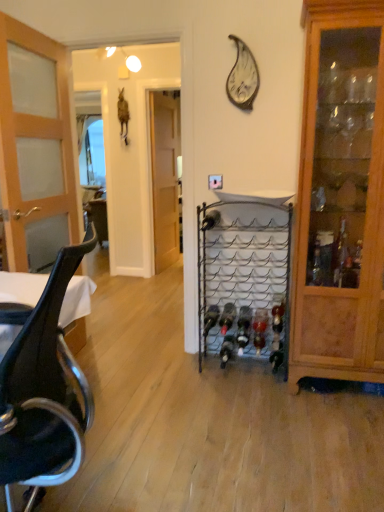
Image resolution: width=384 pixels, height=512 pixels. I want to click on vacant space in front of metallic wire wine rack at center, so click(253, 400).